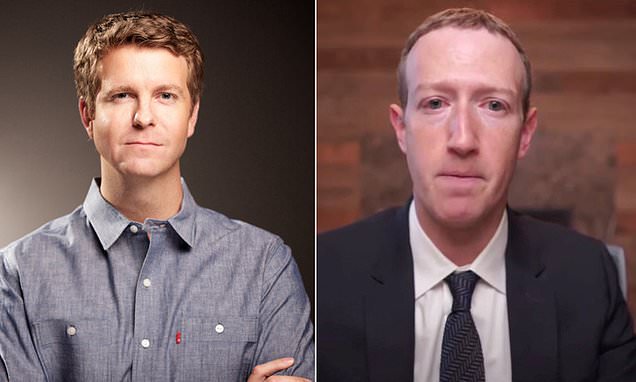
You are a GUI agent. You are given a task and a screenshot of the screen. Output one action in this format:
    pyautogui.click(x=<x>, y=<y>)
    Task: Click on the wall
    The image size is (636, 382).
    Given the screenshot: What is the action you would take?
    point(359,113)